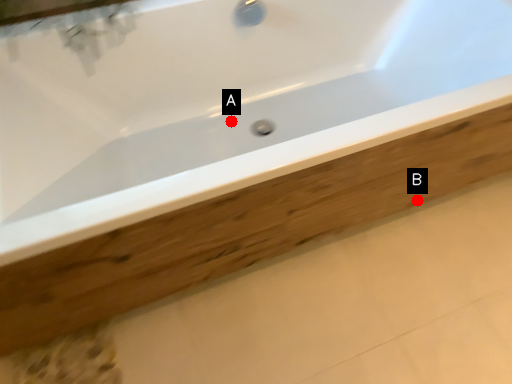
Question: Two points are circled on the image, labeled by A and B beside each circle. Among these points, which one is farthest from the camera?

Choices:
 (A) A is further
 (B) B is further

Answer: (A)